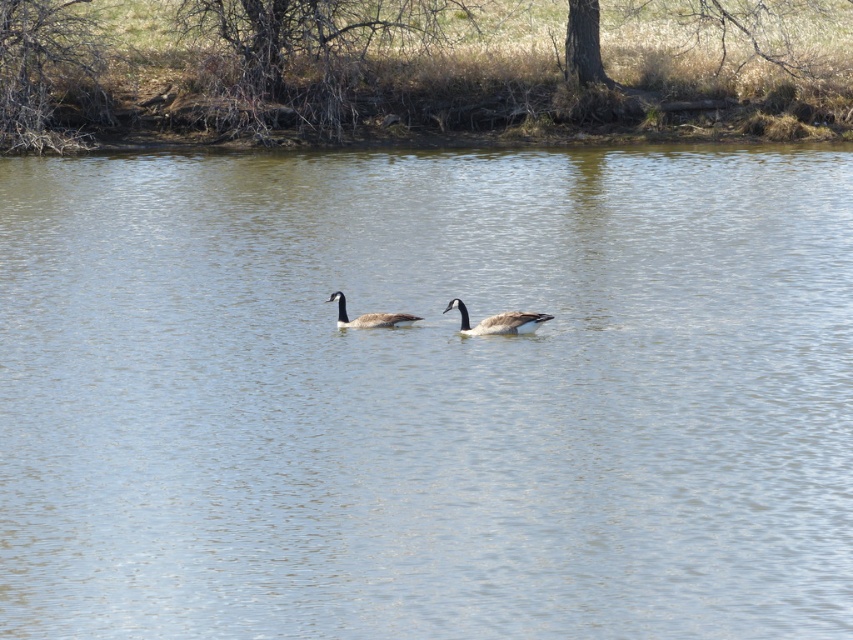
You are a wildlife photographer trying to capture a clear photo of both the brown speckled duck at center and the brown feathered duck at center. Since you want to focus on the smaller duck, which one should you adjust your camera settings for?

The brown feathered duck at center is smaller than the brown speckled duck at center, so you should adjust your camera settings to focus on the brown feathered duck at center.

In the scene shown: You are a wildlife photographer aiming to capture both the brown speckled duck at center and the brown feathered duck at center in a single frame. Given that your camera lens has a fixed focal length, which duck should you focus on to ensure both are in the frame without moving the camera?

You should focus on the brown speckled duck at center because its larger width compared to the brown feathered duck at center allows it to occupy more space, making it easier to frame both ducks without adjusting the camera position.

You are a birdwatcher observing the scene. You see a point at coordinates (498, 321). Which object in the scene is this point located on?

The point at coordinates (498, 321) is located on the brown speckled duck at center.